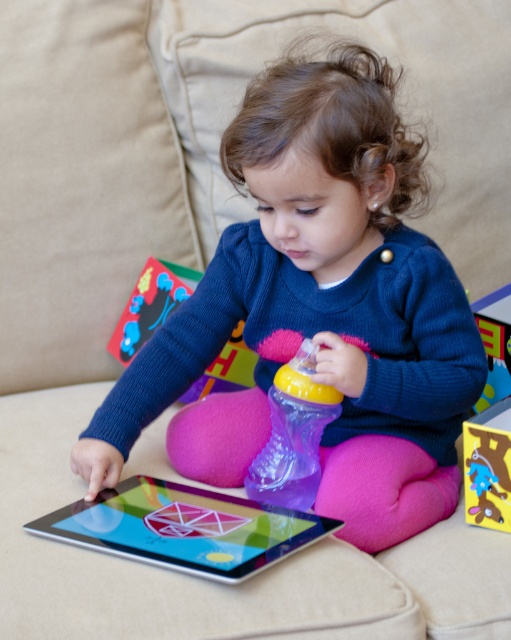
Who is higher up, matte blue sweater at center or plush blue toy at center?

matte blue sweater at center is above.

Measure the distance from matte blue sweater at center to plush blue toy at center.

matte blue sweater at center and plush blue toy at center are 12.98 inches apart from each other.

Is point (334, 216) farther from camera compared to point (484, 456)?

No, it is in front of (484, 456).

Locate an element on the screen. The width and height of the screenshot is (511, 640). matte blue sweater at center is located at coordinates (317, 308).

Can you confirm if matte plastic tablet at center is smaller than plush blue toy at center?

Actually, matte plastic tablet at center might be larger than plush blue toy at center.

Is point (51, 515) behind point (482, 458)?

No, it is not.

Where is `matte plastic tablet at center`? The height and width of the screenshot is (640, 511). matte plastic tablet at center is located at coordinates (184, 528).

Which is in front, point (178, 301) or point (499, 438)?

Positioned in front is point (499, 438).

The width and height of the screenshot is (511, 640). What are the coordinates of `rubberized plastic toy at left` in the screenshot? It's located at (150, 305).